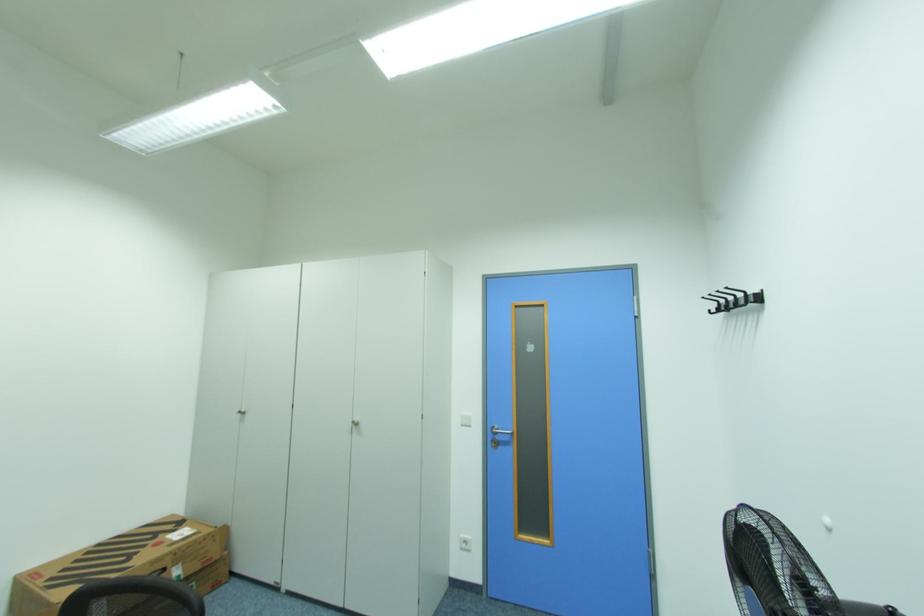
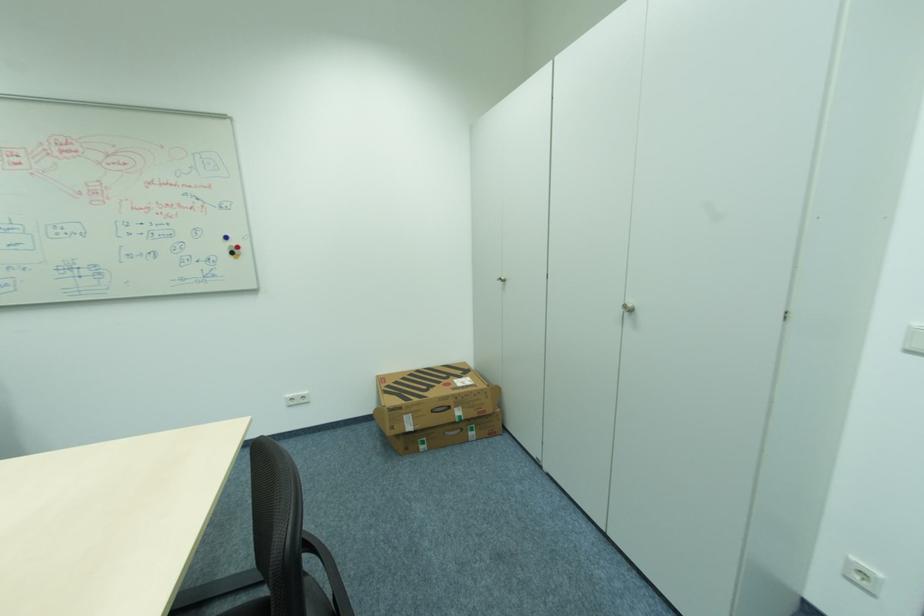
The images are taken continuously from a first-person perspective. In which direction is your viewpoint rotating?

The camera rotated toward left-down.